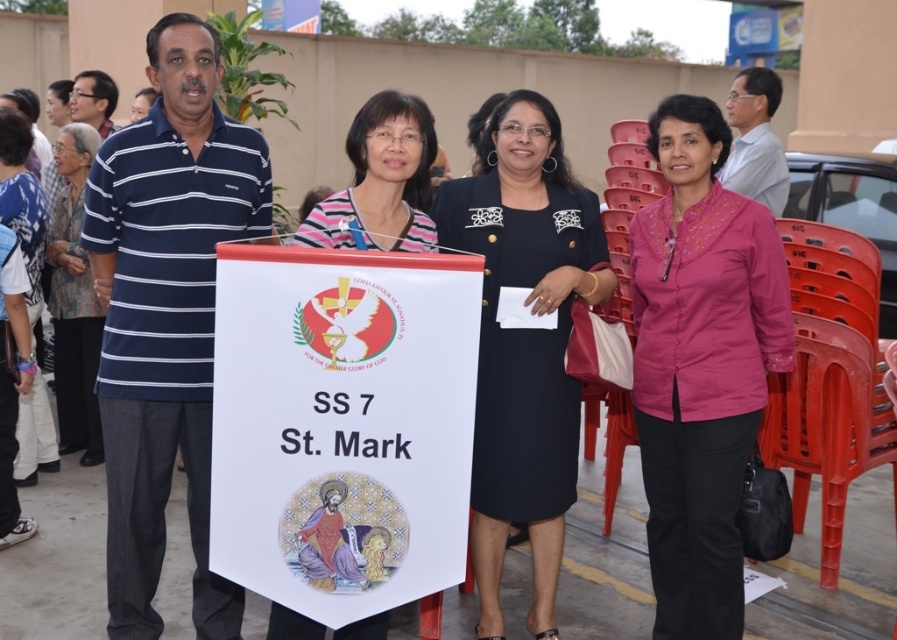
Describe the element at coordinates (167, 314) in the screenshot. I see `blue striped polo shirt at left` at that location.

Can you confirm if blue striped polo shirt at left is taller than striped shirt at center?

Indeed, blue striped polo shirt at left has a greater height compared to striped shirt at center.

Is point (205, 378) positioned in front of point (429, 189)?

Yes, point (205, 378) is in front of point (429, 189).

At what (x,y) coordinates should I click in order to perform the action: click on blue striped polo shirt at left. Please return your answer as a coordinate pair (x, y). Looking at the image, I should click on (167, 314).

Which is more to the left, black satin dress at center or striped fabric shirt at center?

Positioned to the left is striped fabric shirt at center.

Which is behind, point (454, 212) or point (384, 122)?

Point (454, 212)

At what (x,y) coordinates should I click in order to perform the action: click on black satin dress at center. Please return your answer as a coordinate pair (x, y). Looking at the image, I should click on (524, 340).

Between pink fabric shirt at center and white shirt at upper right, which one has more height?

With more height is pink fabric shirt at center.

Does pink fabric shirt at center appear on the left side of white shirt at upper right?

Indeed, pink fabric shirt at center is positioned on the left side of white shirt at upper right.

Locate an element on the screen. The width and height of the screenshot is (897, 640). pink fabric shirt at center is located at coordinates (700, 364).